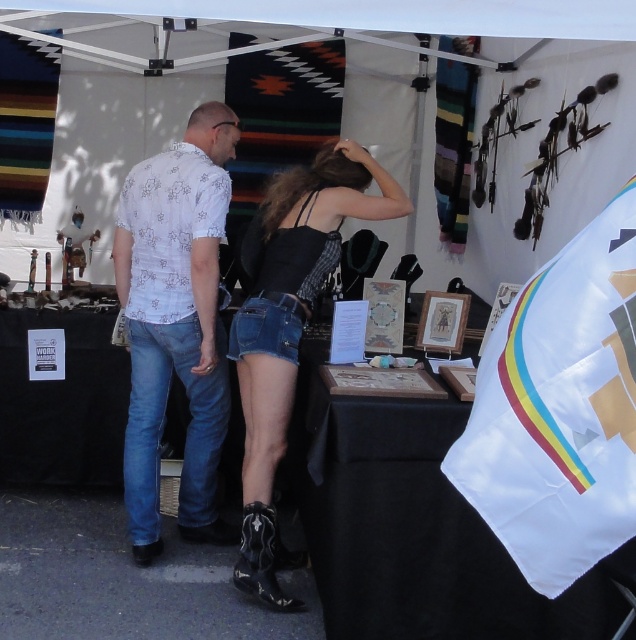
You are a customer at the market and want to greet the vendor. Which item of clothing should you approach first, the white floral shirt at center or the denim shorts at center?

The white floral shirt at center is positioned on the left side of denim shorts at center, so you should approach the white floral shirt at center first since it is closer to your left side.

You are a photographer holding a camera 6.78 feet away from the black fabric table at center. You want to capture the entire table in your photo without moving closer. What adjustment can you make to your camera to ensure the entire table fits in the frame?

Since the camera is 6.78 feet away from the black fabric table at center, you can adjust the camera to a wider angle lens or zoom out to capture the entire table in the frame.

You are a customer at the market and want to buy a souvenir. You see the black fabric table at center and the denim shorts at center. Which item is located to the right of the other?

The black fabric table at center is positioned on the right side of denim shorts at center, so the table is to the right of the denim shorts.